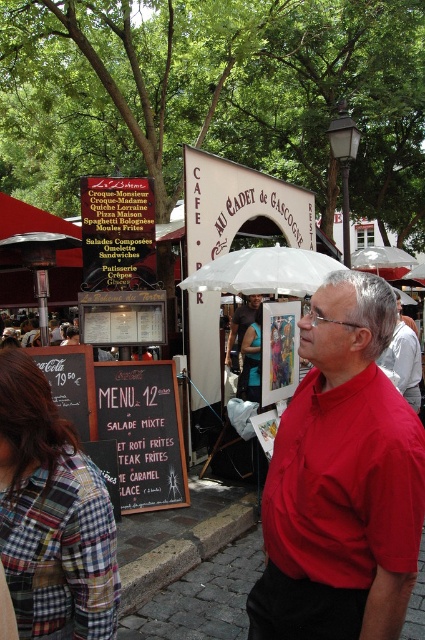
Measure the distance from plaid fabric shirt at lower left to red matte shirt at center.

A distance of 12.26 feet exists between plaid fabric shirt at lower left and red matte shirt at center.

Can you confirm if plaid fabric shirt at lower left is positioned above red matte shirt at center?

Actually, plaid fabric shirt at lower left is below red matte shirt at center.

Is point (87, 554) more distant than point (391, 340)?

No.

I want to click on plaid fabric shirt at lower left, so click(51, 515).

Measure the distance between red smooth shirt at center and black chalkboard menu at lower left.

A: red smooth shirt at center is 10.77 feet from black chalkboard menu at lower left.

Can you confirm if red smooth shirt at center is shorter than black chalkboard menu at lower left?

No.

Identify the location of red smooth shirt at center. The image size is (425, 640). (342, 481).

Image resolution: width=425 pixels, height=640 pixels. I want to click on red smooth shirt at center, so click(x=342, y=481).

You are a GUI agent. You are given a task and a screenshot of the screen. Output one action in this format:
    pyautogui.click(x=<x>, y=<y>)
    Task: Click on the plaid fabric shirt at lower left
    The width and height of the screenshot is (425, 640).
    Given the screenshot: What is the action you would take?
    pyautogui.click(x=51, y=515)

What are the coordinates of `plaid fabric shirt at lower left` in the screenshot? It's located at (51, 515).